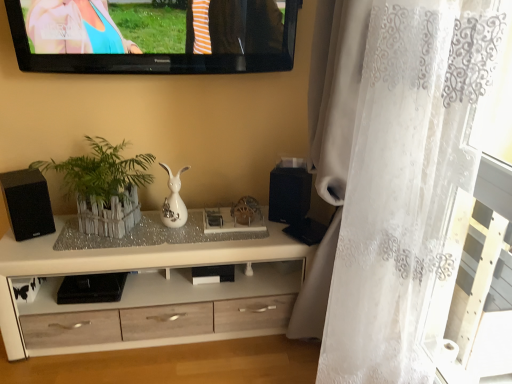
The image size is (512, 384). In order to click on blank space above black matte speaker at left, arranged as the 2th speaker when viewed from the right (from a real-world perspective) in this screenshot , I will do `click(18, 180)`.